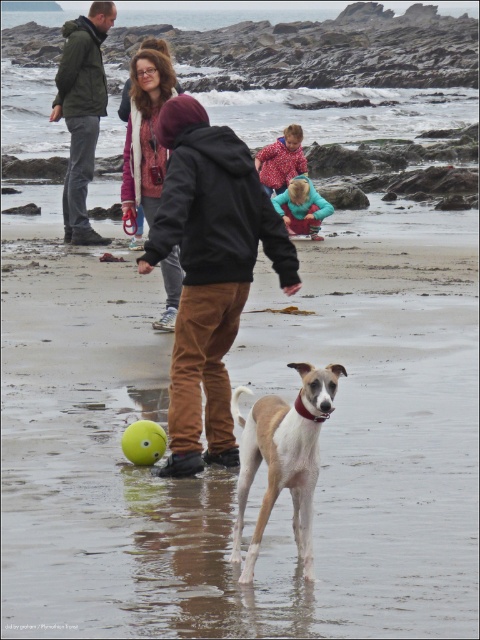
Question: Which of the following is the closest to the observer?

Choices:
 (A) white sand at center
 (B) dark green jacket at upper left

Answer: (A)

Question: Can you confirm if matte purple jacket at center is positioned to the left of blue fleece jacket at center?

Choices:
 (A) yes
 (B) no

Answer: (A)

Question: Which point is farther to the camera?

Choices:
 (A) red polka dot coat at center
 (B) white fur dog at center

Answer: (A)

Question: Which of the following is the farthest from the observer?

Choices:
 (A) blue fleece jacket at center
 (B) white sand at center
 (C) matte purple jacket at center

Answer: (A)

Question: Does brown suede jacket at center appear over blue fleece jacket at center?

Choices:
 (A) no
 (B) yes

Answer: (A)

Question: Where is red polka dot coat at center located in relation to yellow rubber ball at lower center in the image?

Choices:
 (A) right
 (B) left

Answer: (A)